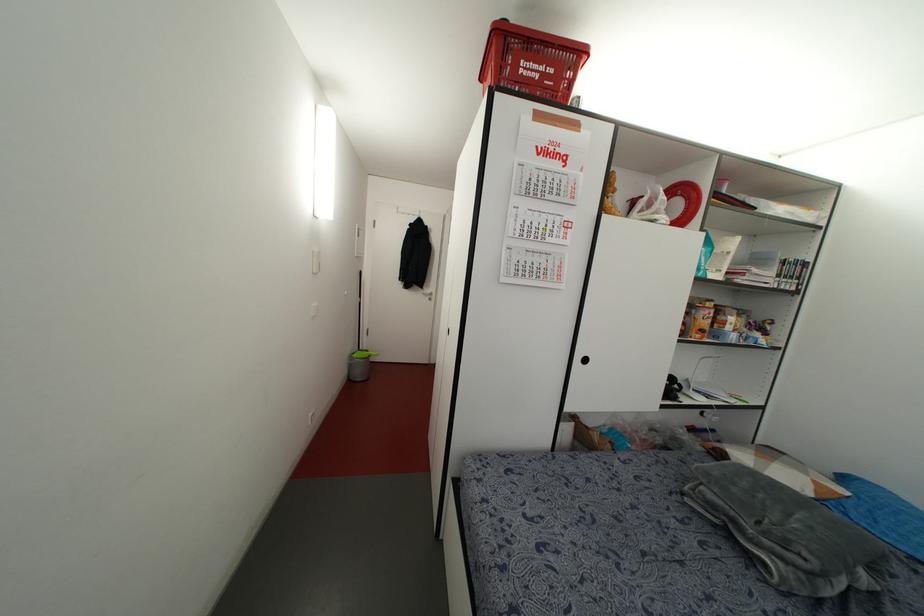
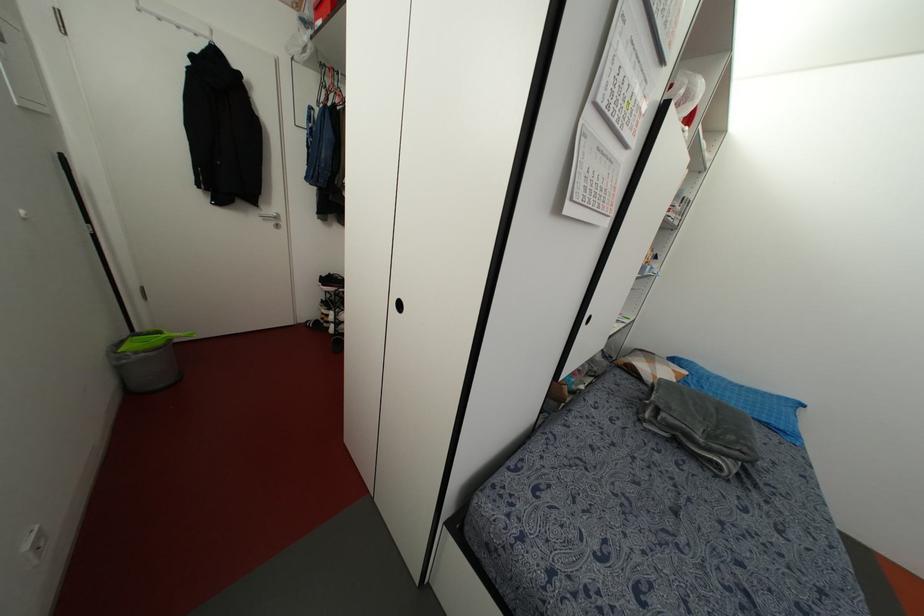
Find the pixel in the second image that matches the point at 429,299 in the first image.

(276, 225)